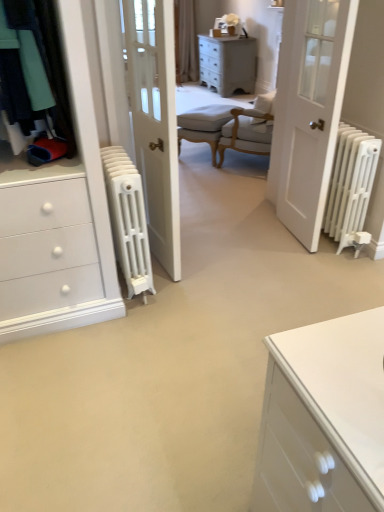
Question: Is white matte radiator at right situated inside white matte radiator at right, marked as the second radiator in a left-to-right arrangement, or outside?

Choices:
 (A) outside
 (B) inside

Answer: (A)

Question: In terms of height, does white matte radiator at right look taller or shorter compared to white matte radiator at right, the 1th radiator viewed from the right?

Choices:
 (A) tall
 (B) short

Answer: (A)

Question: Which object is the farthest from the white matte radiator at left, which is counted as the 1th radiator, starting from the left?

Choices:
 (A) beige fabric curtain at upper center
 (B) white matte radiator at right
 (C) light beige fabric armchair at center
 (D) white matte radiator at right, marked as the second radiator in a left-to-right arrangement
 (E) distressed white chest of drawers at upper center

Answer: (A)

Question: Which of these objects is positioned closest to the white matte radiator at right, the 1th radiator viewed from the right?

Choices:
 (A) light beige fabric armchair at center
 (B) beige fabric curtain at upper center
 (C) distressed white chest of drawers at upper center
 (D) white matte radiator at right
 (E) white matte radiator at left, which is the second radiator from right to left

Answer: (D)